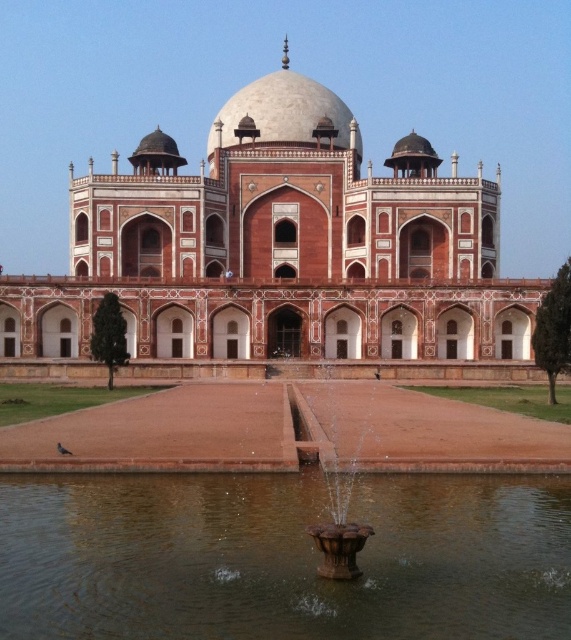
Can you confirm if brown reflective water at center is positioned above bronze metallic fountain at center?

No, brown reflective water at center is not above bronze metallic fountain at center.

From the picture: Does brown reflective water at center have a greater width compared to bronze metallic fountain at center?

Yes.

What do you see at coordinates (283, 557) in the screenshot?
I see `brown reflective water at center` at bounding box center [283, 557].

Identify the location of brown reflective water at center. (283, 557).

Can you confirm if reddish-brown stone palace at center is wider than brown reflective water at center?

Correct, the width of reddish-brown stone palace at center exceeds that of brown reflective water at center.

In the scene shown: Can you confirm if reddish-brown stone palace at center is taller than brown reflective water at center?

Correct, reddish-brown stone palace at center is much taller as brown reflective water at center.

Where is `reddish-brown stone palace at center`? This screenshot has width=571, height=640. reddish-brown stone palace at center is located at coordinates (279, 248).

At what (x,y) coordinates should I click in order to perform the action: click on reddish-brown stone palace at center. Please return your answer as a coordinate pair (x, y). Looking at the image, I should click on (279, 248).

From the picture: Is reddish-brown stone palace at center to the right of bronze metallic fountain at center from the viewer's perspective?

Correct, you'll find reddish-brown stone palace at center to the right of bronze metallic fountain at center.

Is point (275, 161) in front of point (357, 541)?

No.

Does point (110, 289) come closer to viewer compared to point (293, 390)?

No, (110, 289) is behind (293, 390).

Find the location of a particular element. The image size is (571, 640). reddish-brown stone palace at center is located at coordinates (279, 248).